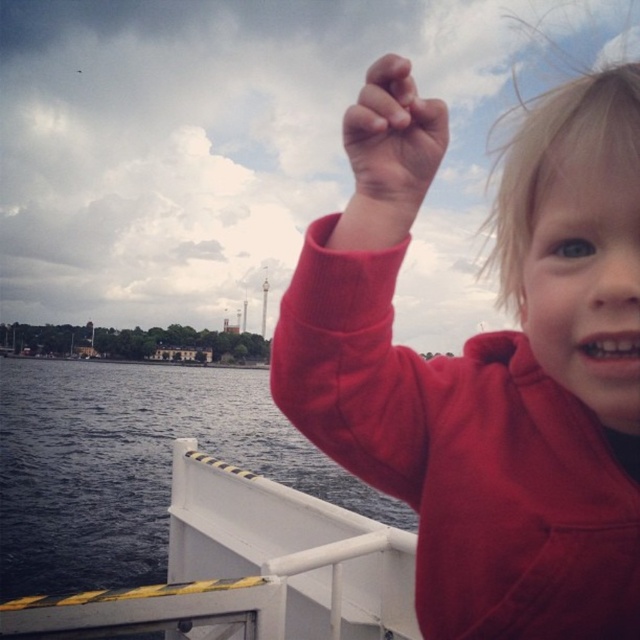
You are a photographer trying to capture the child in the image. The child is wearing a red fleece sweater at upper right and has a matte skin hand at upper center. To ensure both elements are in frame, which object should you position closer to the left side of your camera viewfinder?

The red fleece sweater at upper right should be positioned closer to the left side of the camera viewfinder since it is already to the left of the matte skin hand at upper center.

Consider the image. You are a photographer trying to capture the red fleece sweater at upper right in the image. The camera you are using has a rectangular viewfinder with coordinates ranging from 0 to 1 on both the x and y axes. The center of the viewfinder is at coordinate point 0.5, 0.5. The red fleece sweater at upper right is located at point [488,364]. To ensure the sweater is centered in your viewfinder, what adjustment should you make to the current position of the camera?

The red fleece sweater at upper right is located at point [488,364]. To center it in the viewfinder, you should move the camera so that the center point 0.5, 0.5 aligns with [488,364]. This means adjusting the camera to the right and upward slightly to match the sweater.

You are standing on the boat and want to walk from the point at coordinates point [598,300] to the point at coordinates point [72,461]. Which direction should you move relative to the boat?

You should move towards the lower right direction because point [598,300] is in front of point [72,461], meaning the destination is behind and to the right.